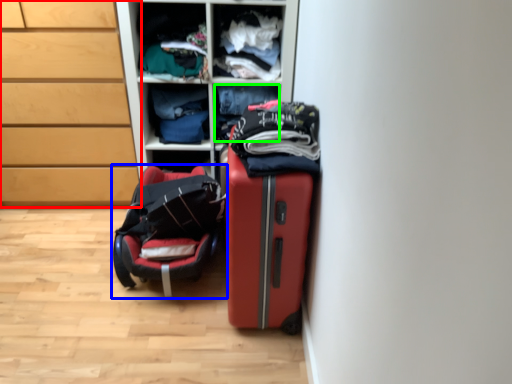
Question: Considering the real-world distances, which object is closest to chest of drawers (highlighted by a red box)? luggage and bags (highlighted by a blue box) or clothing (highlighted by a green box).

Choices:
 (A) luggage and bags
 (B) clothing

Answer: (A)